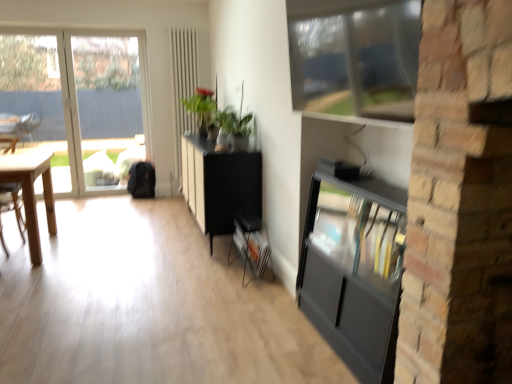
Where is `free region on the left part of metallic gray magazine rack at center`? This screenshot has height=384, width=512. free region on the left part of metallic gray magazine rack at center is located at coordinates (202, 268).